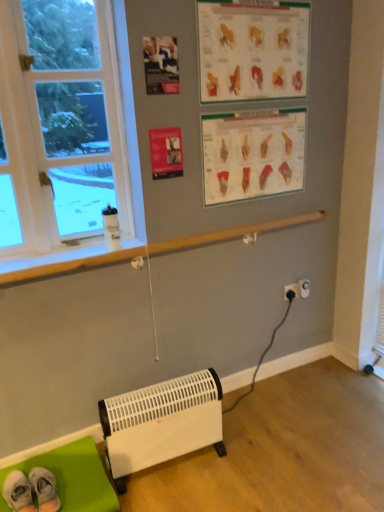
Question: Is the depth of green fabric mat at lower left less than that of matte paper poster at upper center?

Choices:
 (A) yes
 (B) no

Answer: (A)

Question: Is green fabric mat at lower left taller than matte paper poster at upper center?

Choices:
 (A) no
 (B) yes

Answer: (A)

Question: Is green fabric mat at lower left bigger than matte paper poster at upper center?

Choices:
 (A) yes
 (B) no

Answer: (A)

Question: Is green fabric mat at lower left not close to matte paper poster at upper center?

Choices:
 (A) no
 (B) yes

Answer: (B)

Question: Is green fabric mat at lower left turned away from matte paper poster at upper center?

Choices:
 (A) no
 (B) yes

Answer: (A)

Question: From the image's perspective, relative to white plastic heater at lower center, is matte paper poster at upper center above or below?

Choices:
 (A) below
 (B) above

Answer: (B)

Question: In the image, is matte paper poster at upper center positioned in front of or behind white plastic heater at lower center?

Choices:
 (A) front
 (B) behind

Answer: (B)

Question: In the image, is matte paper poster at upper center on the left side or the right side of white plastic heater at lower center?

Choices:
 (A) left
 (B) right

Answer: (A)

Question: In terms of width, does matte paper poster at upper center look wider or thinner when compared to white plastic heater at lower center?

Choices:
 (A) thin
 (B) wide

Answer: (A)

Question: In terms of width, does matte paper poster at upper center look wider or thinner when compared to white fabric socks at lower left?

Choices:
 (A) wide
 (B) thin

Answer: (B)

Question: Do you think matte paper poster at upper center is within white fabric socks at lower left, or outside of it?

Choices:
 (A) outside
 (B) inside

Answer: (A)

Question: In terms of size, does matte paper poster at upper center appear bigger or smaller than white fabric socks at lower left?

Choices:
 (A) small
 (B) big

Answer: (A)

Question: From a real-world perspective, is matte paper poster at upper center above or below white fabric socks at lower left?

Choices:
 (A) below
 (B) above

Answer: (B)

Question: In the image, is white plastic heater at lower center positioned in front of or behind matte plastic poster at upper center, which is counted as the 1th writing, starting from the bottom?

Choices:
 (A) behind
 (B) front

Answer: (B)

Question: Does point (195, 449) appear closer or farther from the camera than point (274, 143)?

Choices:
 (A) closer
 (B) farther

Answer: (A)